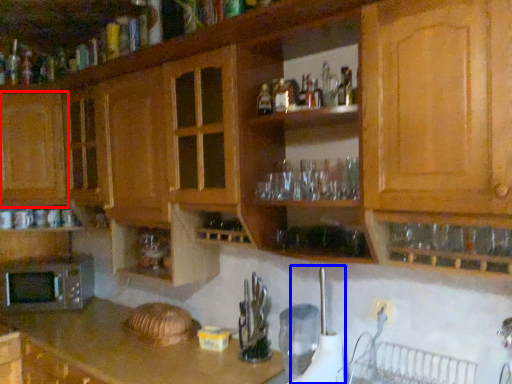
Question: Which object appears closest to the camera in this image, cabinetry (highlighted by a red box) or appliance (highlighted by a blue box)?

Choices:
 (A) cabinetry
 (B) appliance

Answer: (B)